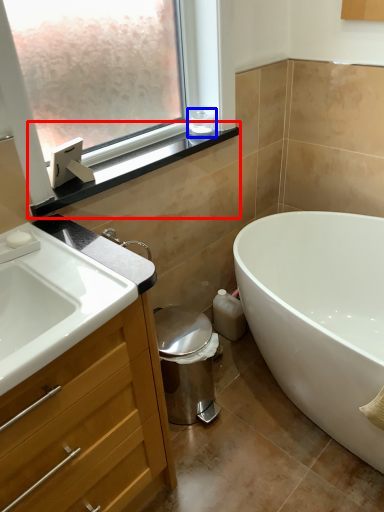
Question: Which of the following is the closest to the observer, window sill (highlighted by a red box) or toiletry (highlighted by a blue box)?

Choices:
 (A) window sill
 (B) toiletry

Answer: (A)